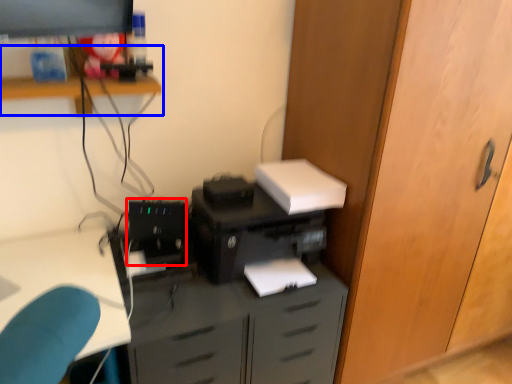
Question: Among these objects, which one is farthest to the camera, computer tower (highlighted by a red box) or shelf (highlighted by a blue box)?

Choices:
 (A) computer tower
 (B) shelf

Answer: (A)